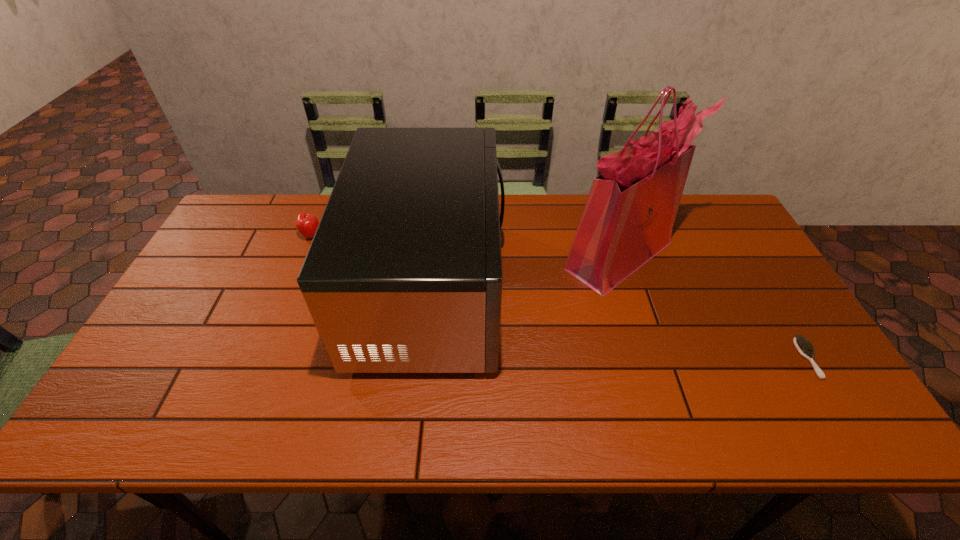
Where is `shopping bag`? The width and height of the screenshot is (960, 540). shopping bag is located at coordinates (628, 218).

Where is `the tallest object`? the tallest object is located at coordinates (628, 218).

The image size is (960, 540). In order to click on the second object from left to right in this screenshot , I will do `click(404, 273)`.

Locate an element on the screen. Image resolution: width=960 pixels, height=540 pixels. microwave oven is located at coordinates (404, 273).

The height and width of the screenshot is (540, 960). I want to click on the leftmost object, so click(306, 223).

This screenshot has height=540, width=960. In order to click on apple in this screenshot , I will do `click(306, 223)`.

Locate an element on the screen. This screenshot has width=960, height=540. scrubbing brush is located at coordinates (805, 348).

What are the coordinates of `the rightmost object` in the screenshot? It's located at (805, 348).

Locate an element on the screen. vacant space situated 0.300m on the front of the third object from left to right is located at coordinates (664, 394).

Locate an element on the screen. Image resolution: width=960 pixels, height=540 pixels. vacant space located 0.310m on the front-facing side of the third shortest object is located at coordinates (613, 289).